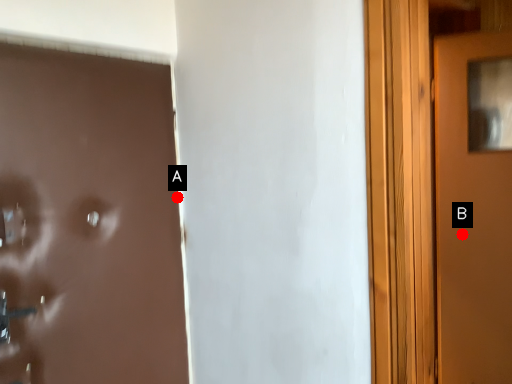
Question: Two points are circled on the image, labeled by A and B beside each circle. Which point is farther from the camera taking this photo?

Choices:
 (A) A is further
 (B) B is further

Answer: (B)